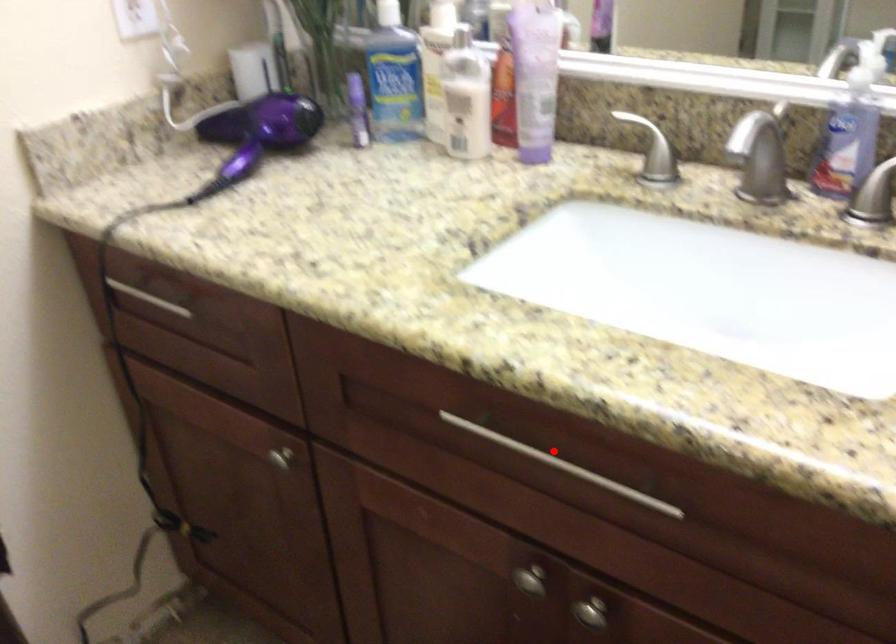
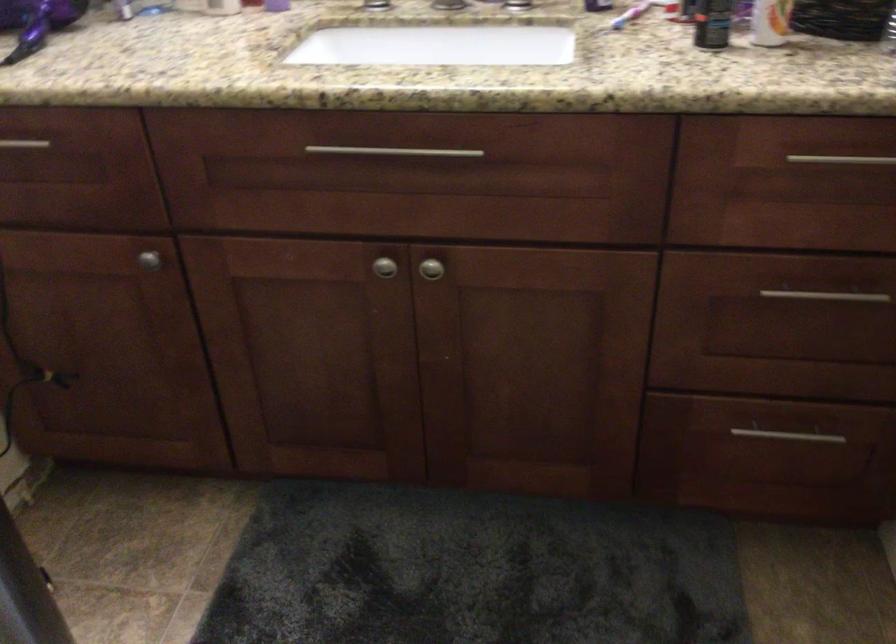
In the second image, find the point that corresponds to the highlighted location in the first image.

(394, 152)